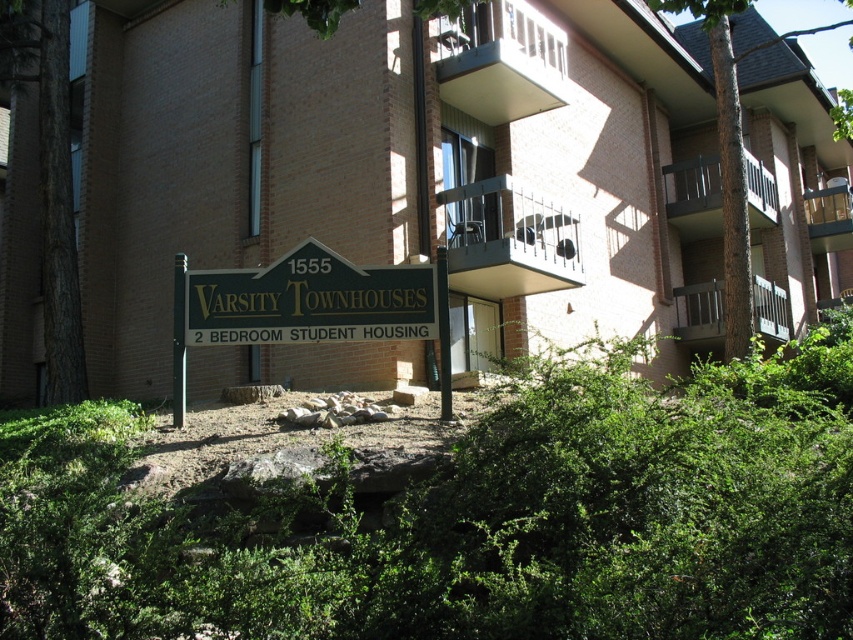
Which of these two, brown rough bark tree at left or smooth concrete balcony at upper center, stands taller?

brown rough bark tree at left is taller.

Is point (44, 212) positioned after point (503, 112)?

That is False.

Where is `brown rough bark tree at left`? Image resolution: width=853 pixels, height=640 pixels. brown rough bark tree at left is located at coordinates (50, 180).

Is smooth concrete balcony at upper center further to the viewer compared to wooden railing at upper right?

That is False.

From the picture: Can you confirm if smooth concrete balcony at upper center is smaller than wooden railing at upper right?

No.

This screenshot has height=640, width=853. Find the location of `smooth concrete balcony at upper center`. smooth concrete balcony at upper center is located at coordinates (502, 64).

Which of these two, greenmaterial/texturesign at center or brown textured tree at upper right, stands shorter?

greenmaterial/texturesign at center is shorter.

Can you confirm if greenmaterial/texturesign at center is smaller than brown textured tree at upper right?

Indeed, greenmaterial/texturesign at center has a smaller size compared to brown textured tree at upper right.

What are the coordinates of `greenmaterial/texturesign at center` in the screenshot? It's located at coord(309,301).